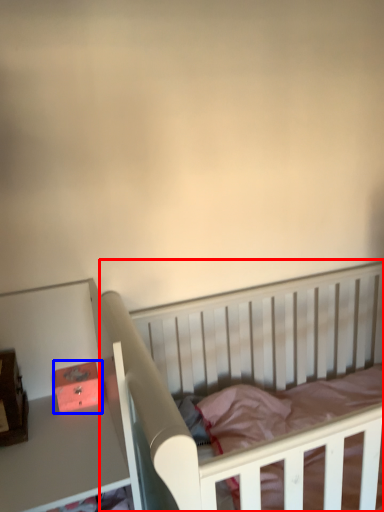
Question: Which object is further to the camera taking this photo, infant bed (highlighted by a red box) or box (highlighted by a blue box)?

Choices:
 (A) infant bed
 (B) box

Answer: (B)